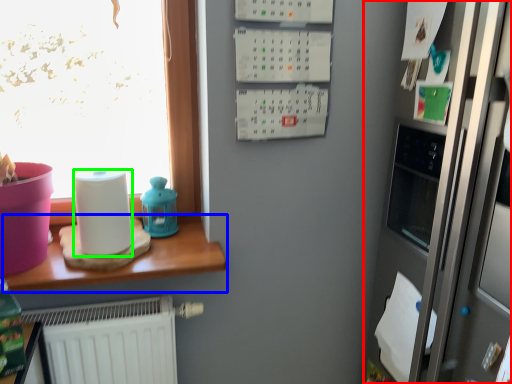
Question: Considering the real-world distances, which object is closest to fridge (highlighted by a red box)? table (highlighted by a blue box) or paper towel (highlighted by a green box).

Choices:
 (A) table
 (B) paper towel

Answer: (A)